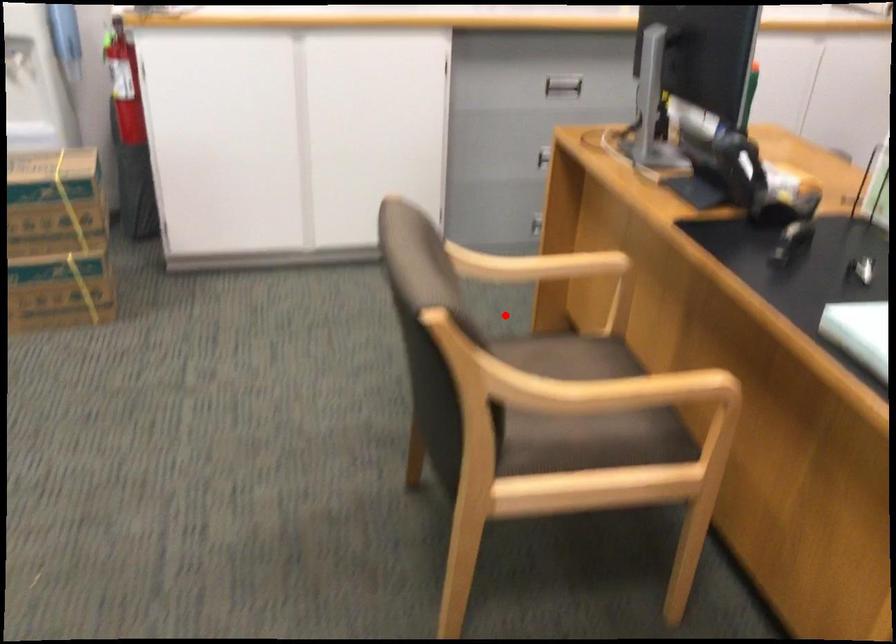
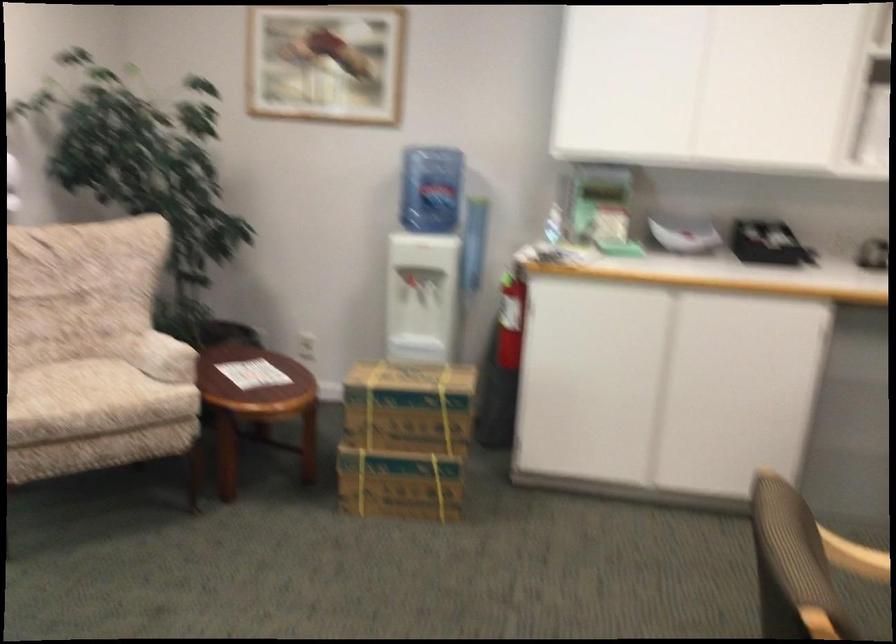
Question: I am providing you with two images of the same scene from different viewpoints. A red point is shown in image1. For the corresponding object point in image2, is it positioned nearer or farther from the camera?

Choices:
 (A) Nearer
 (B) Farther

Answer: (A)